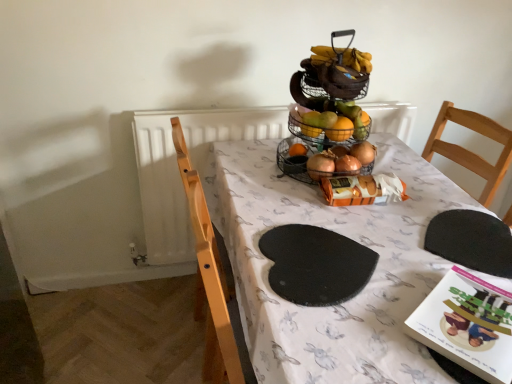
Where is `free space on the front side of black felt mat at center, which ranks as the second mat in right-to-left order`? free space on the front side of black felt mat at center, which ranks as the second mat in right-to-left order is located at coordinates (344, 337).